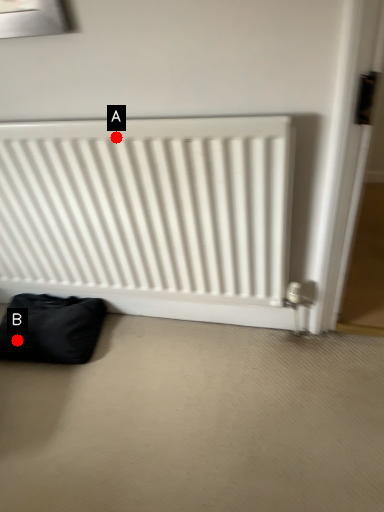
Question: Two points are circled on the image, labeled by A and B beside each circle. Which point is farther to the camera?

Choices:
 (A) A is further
 (B) B is further

Answer: (B)